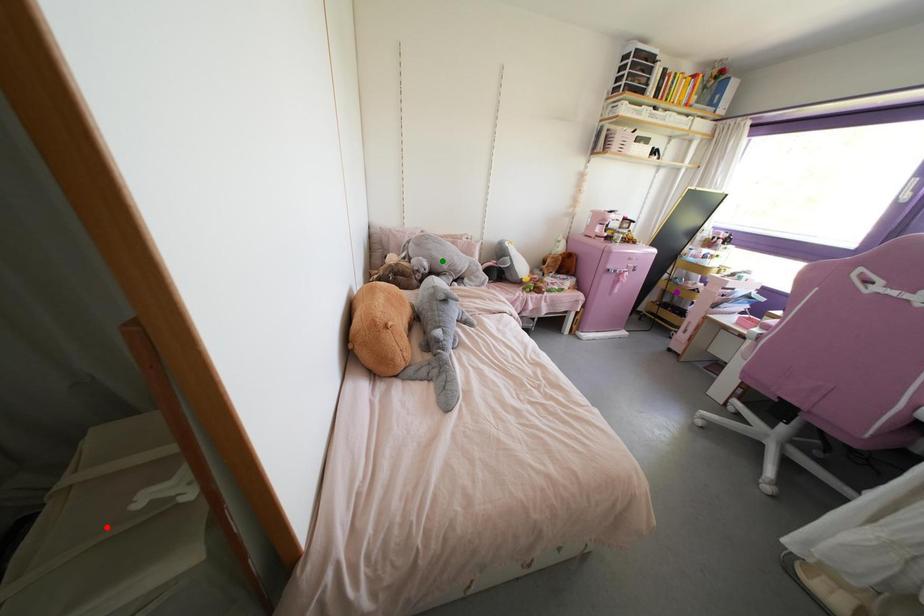
Order these from nearest to farthest:
- red point
- green point
- purple point

1. red point
2. green point
3. purple point